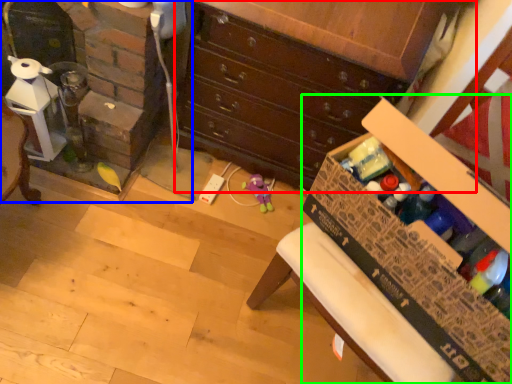
Question: Which is nearer to the chest of drawers (highlighted by a red box)? fireplace (highlighted by a blue box) or cardboard box (highlighted by a green box).

Choices:
 (A) fireplace
 (B) cardboard box

Answer: (A)